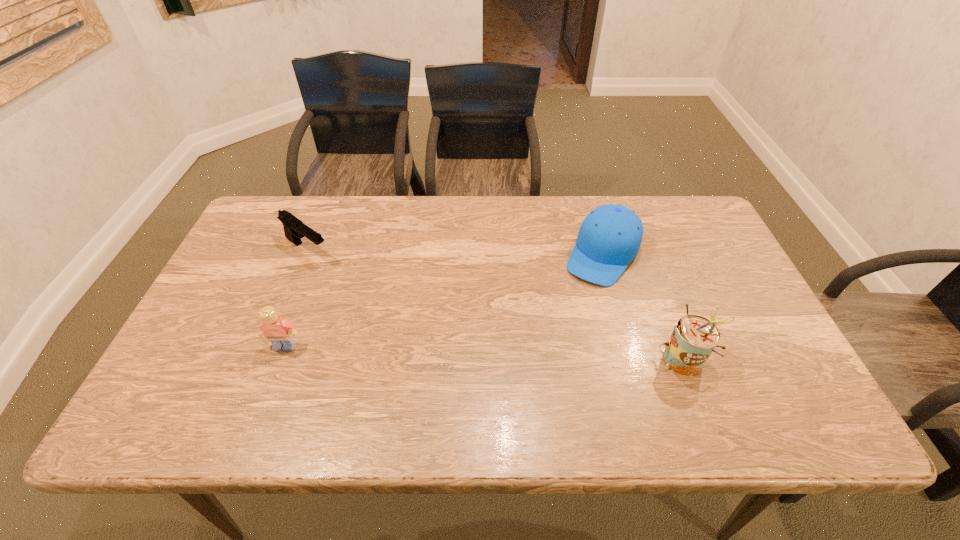
In order to click on vacant spot on the desktop that is between the Lego and the can and is positioned on the front-facing side of the cap in this screenshot , I will do `click(542, 353)`.

Where is `vacant space on the desktop that is between the Lego and the can and is positioned on the front-facing side of the pistol`? Image resolution: width=960 pixels, height=540 pixels. vacant space on the desktop that is between the Lego and the can and is positioned on the front-facing side of the pistol is located at coordinates (447, 350).